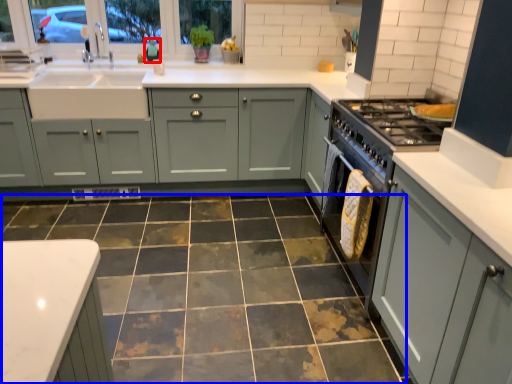
Question: Which of the following is the farthest to the observer, teal (highlighted by a red box) or ceramic tile (highlighted by a blue box)?

Choices:
 (A) teal
 (B) ceramic tile

Answer: (A)